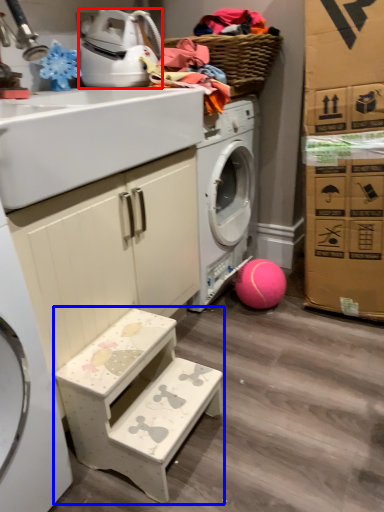
Question: Among these objects, which one is farthest to the camera, appliance (highlighted by a red box) or step stool (highlighted by a blue box)?

Choices:
 (A) appliance
 (B) step stool

Answer: (A)